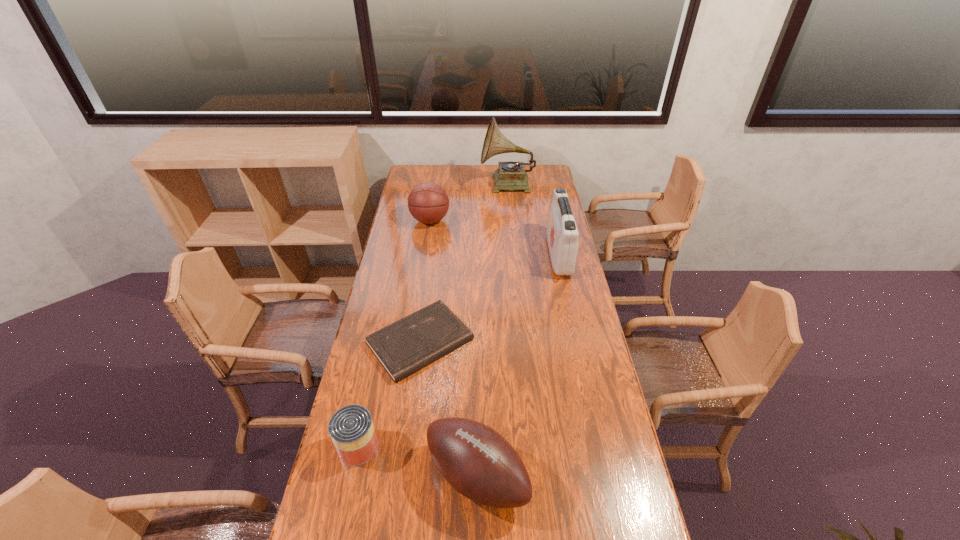
At what (x,y) coordinates should I click in order to perform the action: click on free spot that satisfies the following two spatial constraints: 1. from the horn of the tallest object; 2. on the front side of the basketball. Please return your answer as a coordinate pair (x, y). The image size is (960, 540). Looking at the image, I should click on (511, 220).